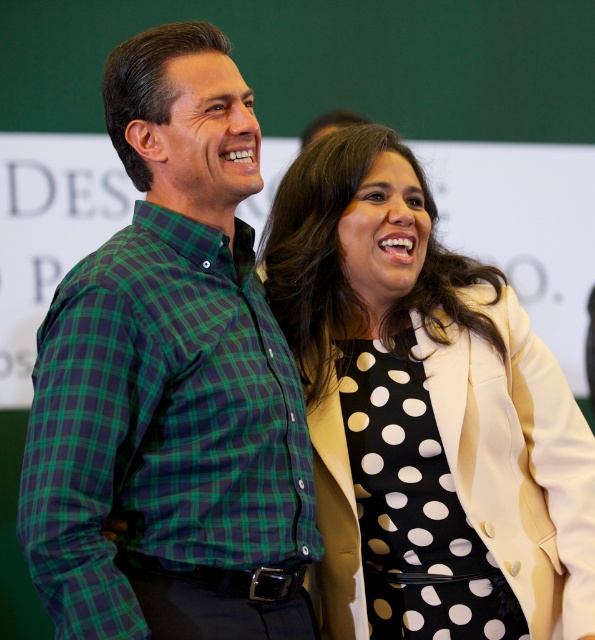
Between green plaid shirt at center and white dotted dress at center, which one appears on the right side from the viewer's perspective?

From the viewer's perspective, white dotted dress at center appears more on the right side.

Is green plaid shirt at center taller than white dotted dress at center?

Indeed, green plaid shirt at center has a greater height compared to white dotted dress at center.

Describe the element at coordinates (170, 384) in the screenshot. The width and height of the screenshot is (595, 640). I see `green plaid shirt at center` at that location.

The height and width of the screenshot is (640, 595). Find the location of `green plaid shirt at center`. green plaid shirt at center is located at coordinates (170, 384).